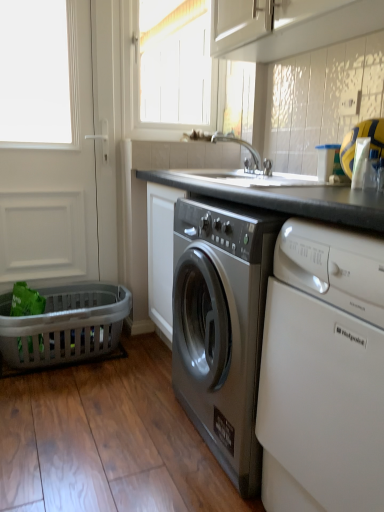
Question: Is white glossy cabinet at upper center looking in the opposite direction of gray plastic laundry basket at lower left?

Choices:
 (A) yes
 (B) no

Answer: (B)

Question: Is white glossy cabinet at upper center positioned far away from gray plastic laundry basket at lower left?

Choices:
 (A) no
 (B) yes

Answer: (B)

Question: Is gray plastic laundry basket at lower left inside white glossy cabinet at upper center?

Choices:
 (A) no
 (B) yes

Answer: (A)

Question: Is white glossy cabinet at upper center oriented towards gray plastic laundry basket at lower left?

Choices:
 (A) yes
 (B) no

Answer: (B)

Question: Does white glossy cabinet at upper center have a greater width compared to gray plastic laundry basket at lower left?

Choices:
 (A) yes
 (B) no

Answer: (B)

Question: Is white glossy cabinet at upper center positioned behind gray plastic laundry basket at lower left?

Choices:
 (A) no
 (B) yes

Answer: (A)

Question: Can you confirm if white wood window at upper center is positioned to the right of white glossy cabinet at upper center?

Choices:
 (A) no
 (B) yes

Answer: (A)

Question: Is white wood window at upper center shorter than white glossy cabinet at upper center?

Choices:
 (A) no
 (B) yes

Answer: (A)

Question: Can you confirm if white wood window at upper center is bigger than white glossy cabinet at upper center?

Choices:
 (A) yes
 (B) no

Answer: (A)

Question: Can you confirm if white wood window at upper center is taller than white glossy cabinet at upper center?

Choices:
 (A) no
 (B) yes

Answer: (B)

Question: Is white wood window at upper center positioned behind white glossy cabinet at upper center?

Choices:
 (A) no
 (B) yes

Answer: (B)

Question: From a real-world perspective, is white wood window at upper center under white glossy cabinet at upper center?

Choices:
 (A) no
 (B) yes

Answer: (A)

Question: Is white matte screen door at left positioned far away from white wood window at upper center?

Choices:
 (A) yes
 (B) no

Answer: (A)